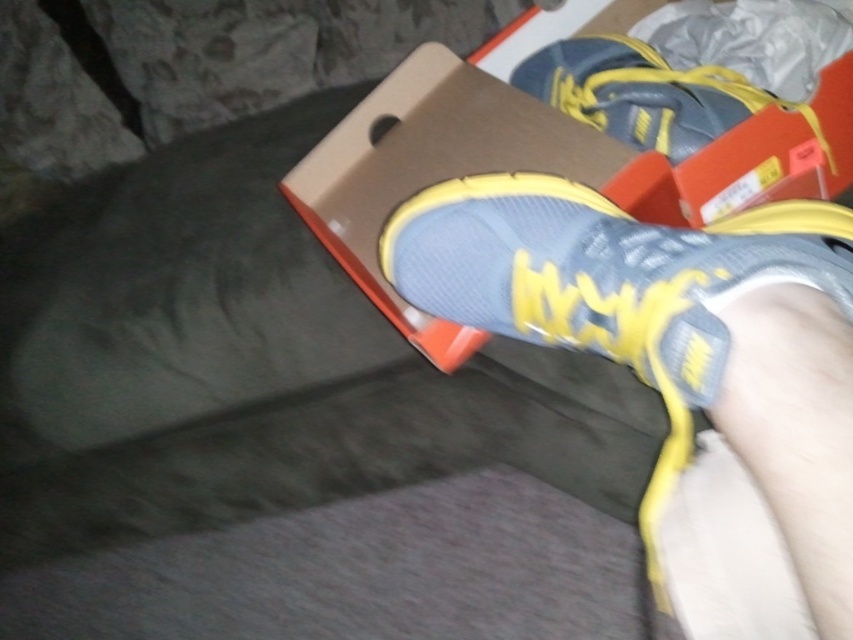
Question: Which point is closer to the camera taking this photo?

Choices:
 (A) (397, 172)
 (B) (630, 145)

Answer: (B)

Question: Based on their relative distances, which object is farther from the matte blue shoe at center?

Choices:
 (A) matte cardboard shoebox at center
 (B) matte blue sneaker at upper center

Answer: (B)

Question: Can you confirm if matte cardboard shoebox at center is smaller than matte blue sneaker at upper center?

Choices:
 (A) no
 (B) yes

Answer: (A)

Question: Which of the following is the farthest from the observer?

Choices:
 (A) 338,136
 (B) 532,81
 (C) 683,396

Answer: (B)

Question: Does matte blue shoe at center have a larger size compared to matte blue sneaker at upper center?

Choices:
 (A) yes
 (B) no

Answer: (A)

Question: Is matte cardboard shoebox at center positioned at the back of matte blue sneaker at upper center?

Choices:
 (A) no
 (B) yes

Answer: (A)